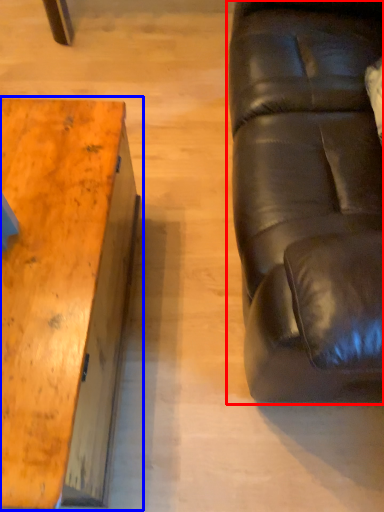
Question: Which object appears closest to the camera in this image, studio couch (highlighted by a red box) or table (highlighted by a blue box)?

Choices:
 (A) studio couch
 (B) table

Answer: (A)